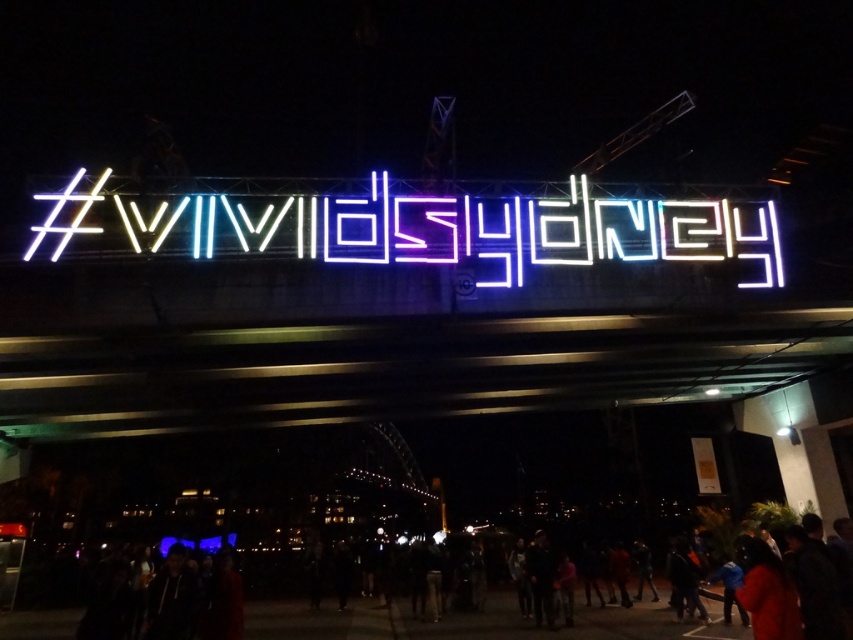
Question: Is neontextsign at center to the left of black jacket at lower center from the viewer's perspective?

Choices:
 (A) yes
 (B) no

Answer: (A)

Question: In this image, where is neontextsign at center located relative to black jacket at lower center?

Choices:
 (A) right
 (B) left

Answer: (B)

Question: Is neontextsign at center to the left of black jacket at lower center from the viewer's perspective?

Choices:
 (A) no
 (B) yes

Answer: (B)

Question: Which point is farther from the camera taking this photo?

Choices:
 (A) (54, 234)
 (B) (368, 634)

Answer: (B)